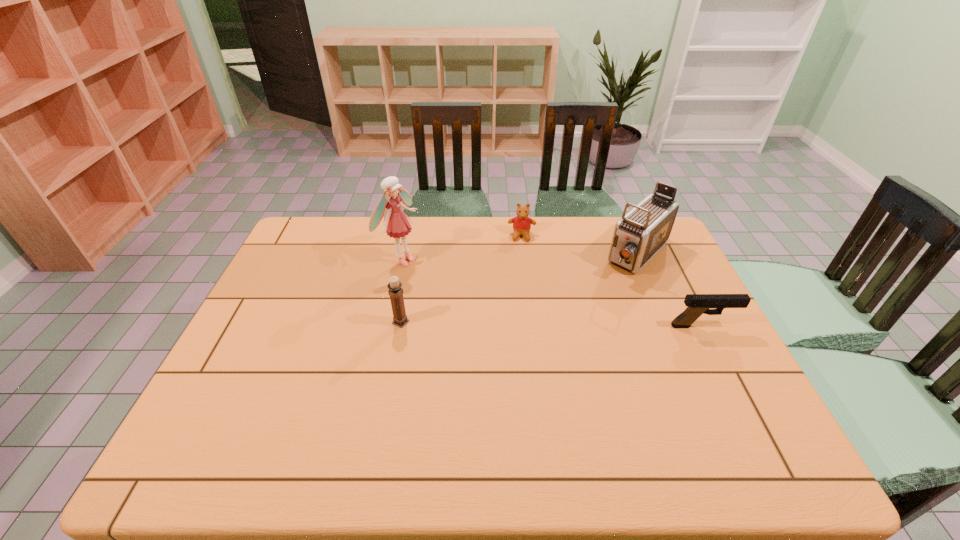
Where is `unoccupied area between the tallest object and the teddy bear`? This screenshot has height=540, width=960. unoccupied area between the tallest object and the teddy bear is located at coordinates (462, 247).

The width and height of the screenshot is (960, 540). In order to click on free point between the pistol and the fourth shortest object in this screenshot , I will do `click(671, 291)`.

This screenshot has width=960, height=540. In order to click on free space between the third shortest object and the camcorder in this screenshot , I will do `click(520, 288)`.

At what (x,y) coordinates should I click in order to perform the action: click on free space that is in between the fourth shortest object and the doll. Please return your answer as a coordinate pair (x, y). Looking at the image, I should click on (520, 257).

Where is `free point between the camcorder and the candle holder`? The height and width of the screenshot is (540, 960). free point between the camcorder and the candle holder is located at coordinates pyautogui.click(x=520, y=288).

The height and width of the screenshot is (540, 960). What are the coordinates of `free space between the tallest object and the teddy bear` in the screenshot? It's located at (462, 247).

Where is `free spot between the doll and the second tallest object`? free spot between the doll and the second tallest object is located at coordinates (520, 257).

This screenshot has width=960, height=540. Find the location of `object that is the second closest to the doll`. object that is the second closest to the doll is located at coordinates (522, 223).

Find the location of a particular element. Image resolution: width=960 pixels, height=540 pixels. the second closest object to the pistol is located at coordinates (522, 223).

This screenshot has height=540, width=960. I want to click on free space that satisfies the following two spatial constraints: 1. on the front side of the pistol; 2. on the front-facing side of the doll, so click(x=387, y=326).